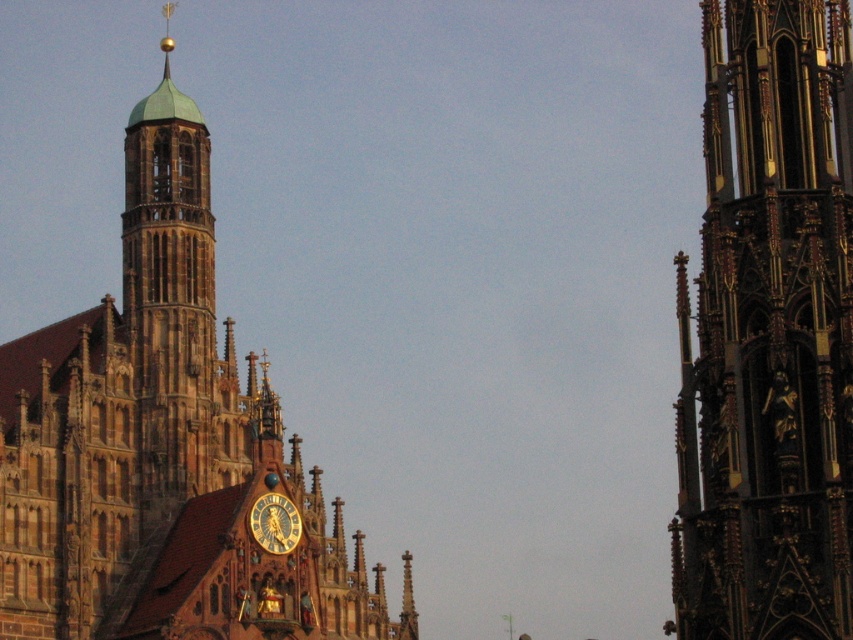
Question: Can you confirm if brown stone church at center is positioned to the right of gold/gilded stone tower at right?

Choices:
 (A) yes
 (B) no

Answer: (B)

Question: Which object is farther from the camera taking this photo?

Choices:
 (A) gold/gilded stone tower at right
 (B) brown stone church at center
 (C) gold metallic clock at center

Answer: (C)

Question: Does brown stone church at center have a lesser width compared to gold/gilded stone tower at right?

Choices:
 (A) no
 (B) yes

Answer: (A)

Question: Which of the following is the farthest from the observer?

Choices:
 (A) (271, 522)
 (B) (45, 451)
 (C) (685, 636)

Answer: (B)

Question: Where is brown stone church at center located in relation to gold metallic clock at center in the image?

Choices:
 (A) right
 (B) left

Answer: (B)

Question: Which point appears farthest from the camera in this image?

Choices:
 (A) (294, 538)
 (B) (776, 170)
 (C) (271, 452)

Answer: (C)